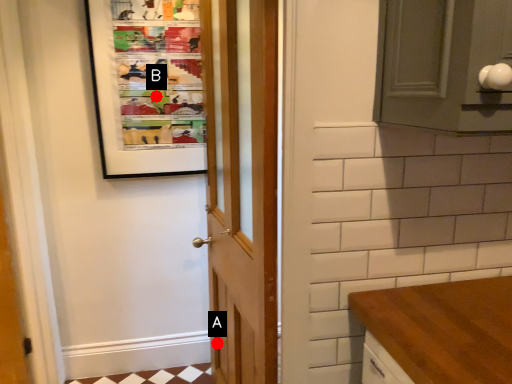
Question: Two points are circled on the image, labeled by A and B beside each circle. Which of the following is the closest to the observer?

Choices:
 (A) A is closer
 (B) B is closer

Answer: (A)